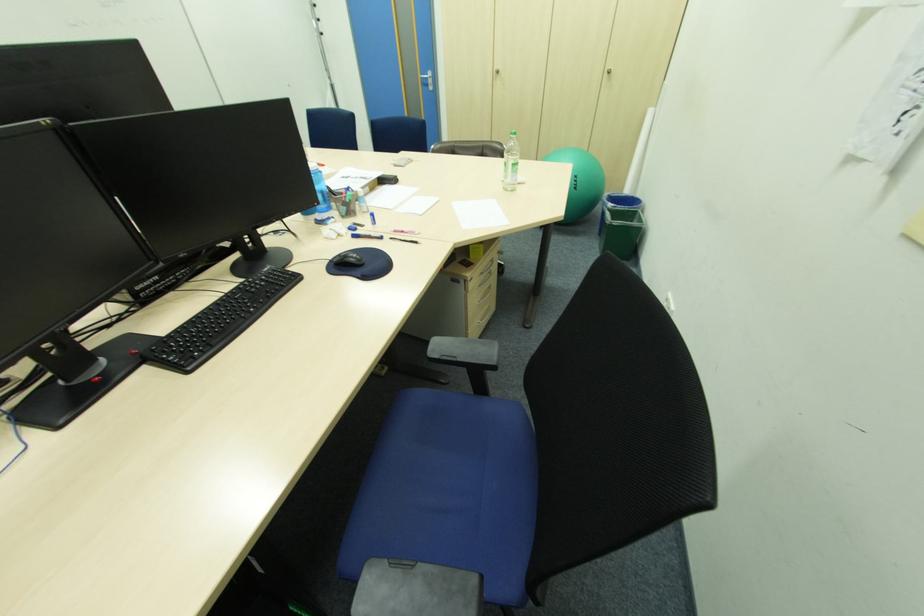
You are a GUI agent. You are given a task and a screenshot of the screen. Output one action in this format:
    pyautogui.click(x=<x>, y=<y>)
    Task: Click on the clear pen holder
    This screenshot has height=616, width=924.
    Given the screenshot: What is the action you would take?
    pyautogui.click(x=347, y=201)